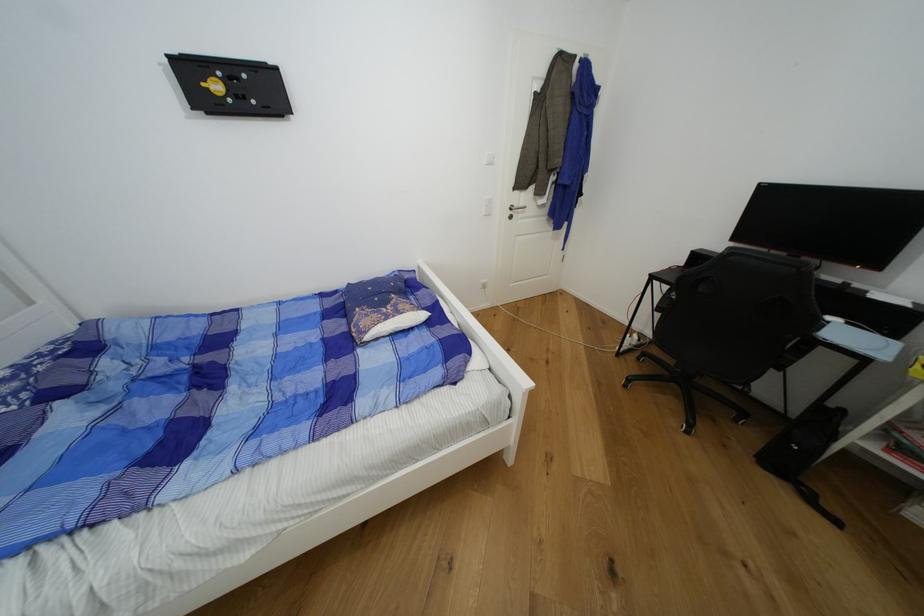
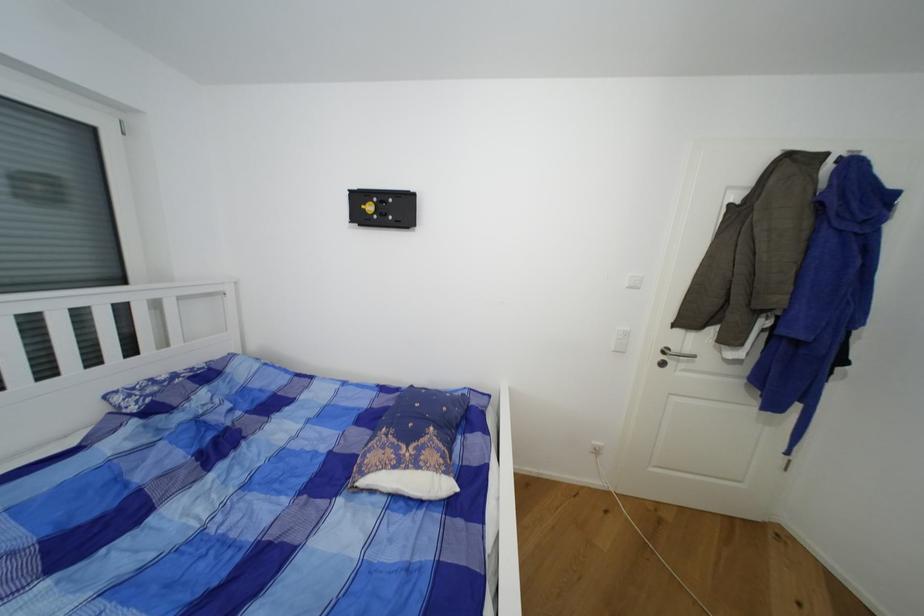
In the second image, find the point that corresponds to point (429, 315) in the first image.

(454, 488)